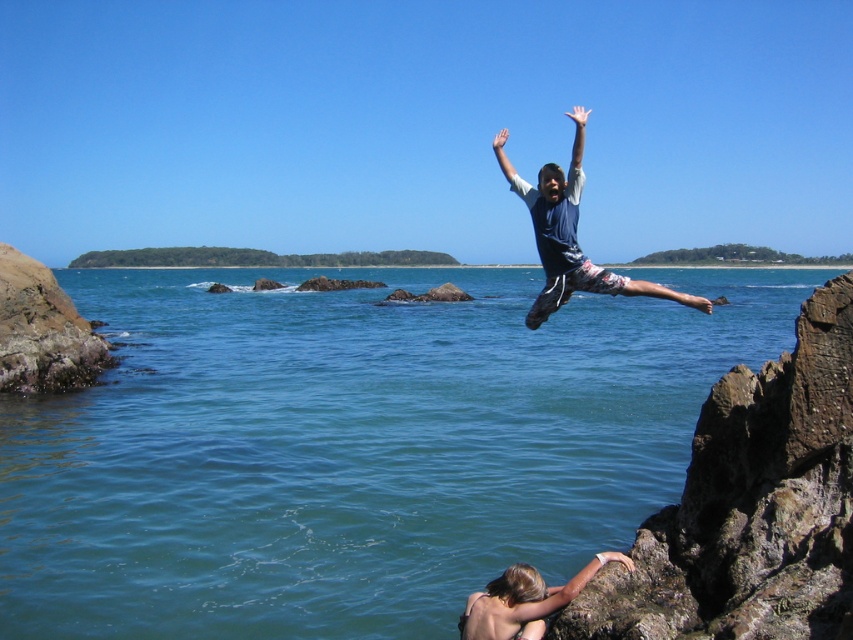
Which is behind, point (144, 337) or point (479, 636)?

The point (144, 337) is more distant.

Between point (233, 532) and point (485, 596), which one is positioned behind?

The point (233, 532) is behind.

Locate an element on the screen. The image size is (853, 640). clear blue water at center is located at coordinates (352, 445).

Does brown rough rock at right appear on the left side of blue cotton shirt at upper center?

Indeed, brown rough rock at right is positioned on the left side of blue cotton shirt at upper center.

Does brown rough rock at right have a lesser width compared to blue cotton shirt at upper center?

Yes.

Who is more distant from viewer, (798,625) or (577,134)?

The point (577,134) is more distant.

What are the coordinates of `brown rough rock at right` in the screenshot? It's located at (750, 506).

Which is in front, point (164, 449) or point (585, 269)?

Point (585, 269) is more forward.

From the picture: Measure the distance between clear blue water at center and camera.

A distance of 9.17 meters exists between clear blue water at center and camera.

You are a GUI agent. You are given a task and a screenshot of the screen. Output one action in this format:
    pyautogui.click(x=<x>, y=<y>)
    Task: Click on the clear blue water at center
    This screenshot has width=853, height=640.
    Given the screenshot: What is the action you would take?
    pyautogui.click(x=352, y=445)